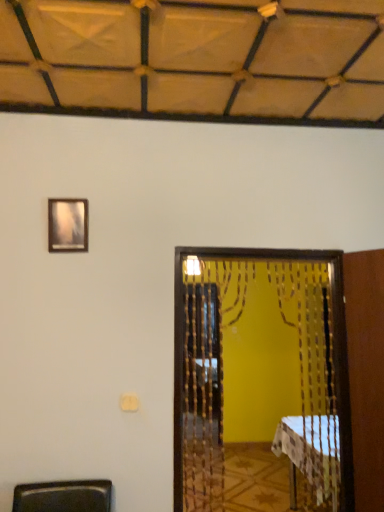
Question: Is wooden frame at upper left outside wooden beaded screen door at center?

Choices:
 (A) no
 (B) yes

Answer: (B)

Question: Is wooden frame at upper left bigger than wooden beaded screen door at center?

Choices:
 (A) yes
 (B) no

Answer: (B)

Question: From the image's perspective, is wooden frame at upper left located above wooden beaded screen door at center?

Choices:
 (A) yes
 (B) no

Answer: (A)

Question: Is wooden frame at upper left further to the viewer compared to wooden beaded screen door at center?

Choices:
 (A) no
 (B) yes

Answer: (B)

Question: Does wooden frame at upper left lie in front of wooden beaded screen door at center?

Choices:
 (A) no
 (B) yes

Answer: (A)

Question: Can you confirm if wooden frame at upper left is positioned to the left of wooden beaded screen door at center?

Choices:
 (A) no
 (B) yes

Answer: (B)

Question: Is wooden beaded screen door at center far from white checkered tablecloth at lower right?

Choices:
 (A) yes
 (B) no

Answer: (B)

Question: Is white checkered tablecloth at lower right located within wooden beaded screen door at center?

Choices:
 (A) yes
 (B) no

Answer: (B)

Question: Is wooden beaded screen door at center positioned before white checkered tablecloth at lower right?

Choices:
 (A) no
 (B) yes

Answer: (B)

Question: Can you see wooden beaded screen door at center touching white checkered tablecloth at lower right?

Choices:
 (A) yes
 (B) no

Answer: (B)

Question: Does wooden beaded screen door at center have a greater height compared to white checkered tablecloth at lower right?

Choices:
 (A) yes
 (B) no

Answer: (A)

Question: From the image's perspective, does wooden beaded screen door at center appear higher than white checkered tablecloth at lower right?

Choices:
 (A) yes
 (B) no

Answer: (A)

Question: Can you see white checkered tablecloth at lower right touching wooden beaded screen door at center?

Choices:
 (A) no
 (B) yes

Answer: (A)